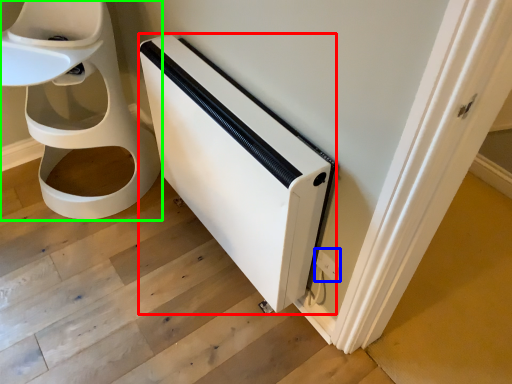
Question: Which object is positioned farthest from appliance (highlighted by a red box)? Select from electric outlet (highlighted by a blue box) and toilet (highlighted by a green box).

Choices:
 (A) electric outlet
 (B) toilet

Answer: (B)